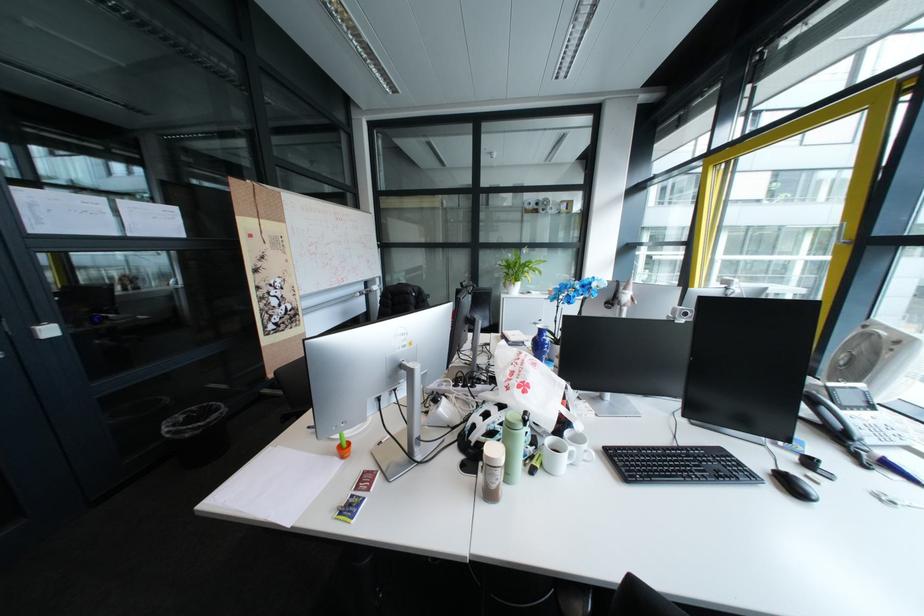
Where would you lift the black keyboard? Please return your answer as a coordinate pair (x, y).

(678, 464)